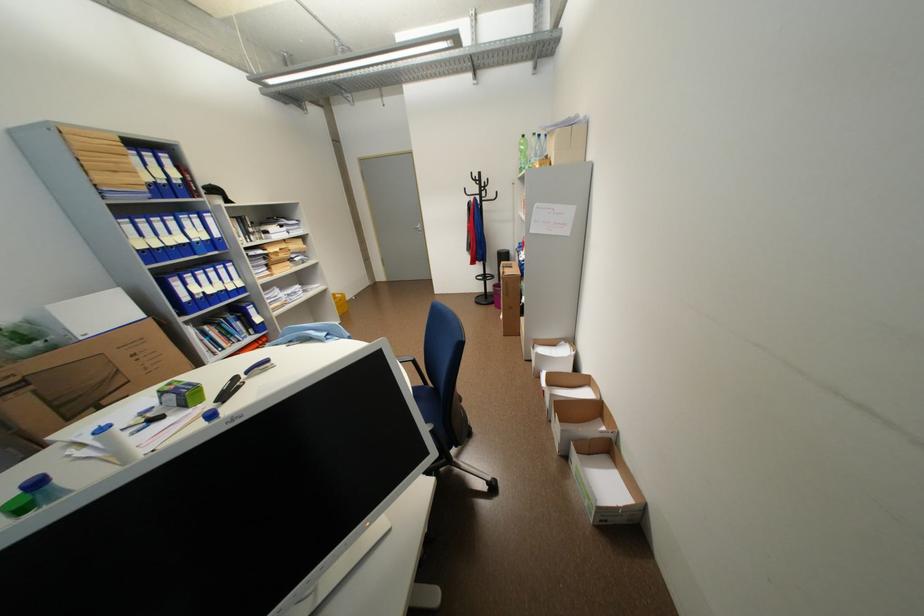
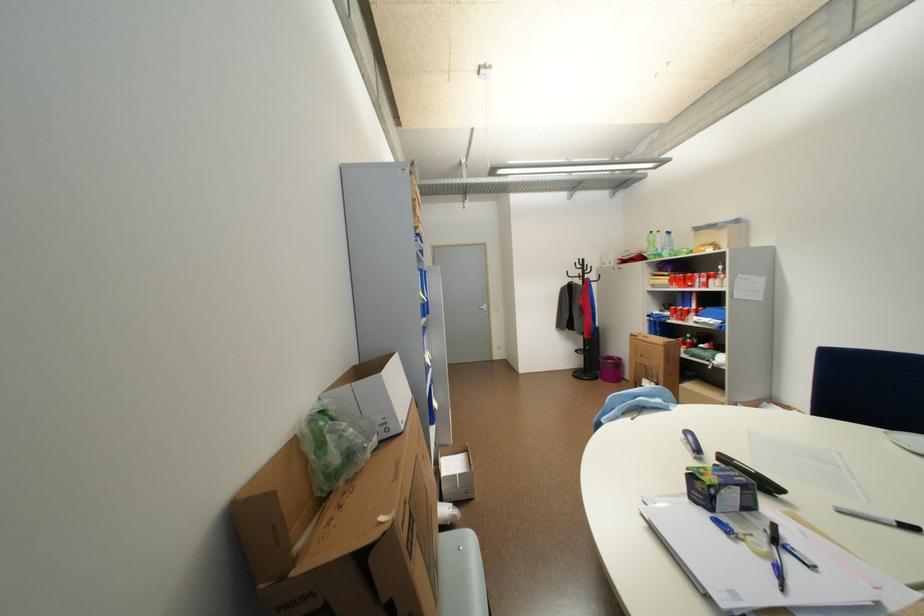
Question: In a continuous first-person perspective shot, in which direction is the camera moving?

Choices:
 (A) Left
 (B) Right
 (C) Forward
 (D) Backward

Answer: (A)